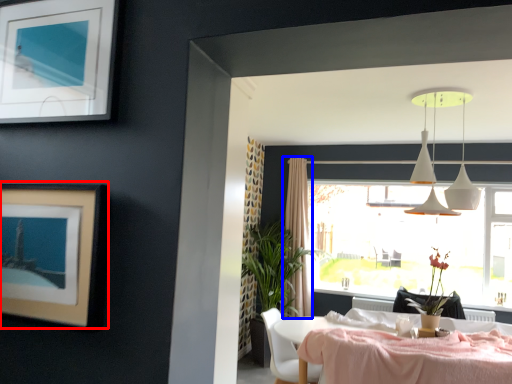
Question: Which object is further to the camera taking this photo, picture frame (highlighted by a red box) or curtain (highlighted by a blue box)?

Choices:
 (A) picture frame
 (B) curtain

Answer: (B)